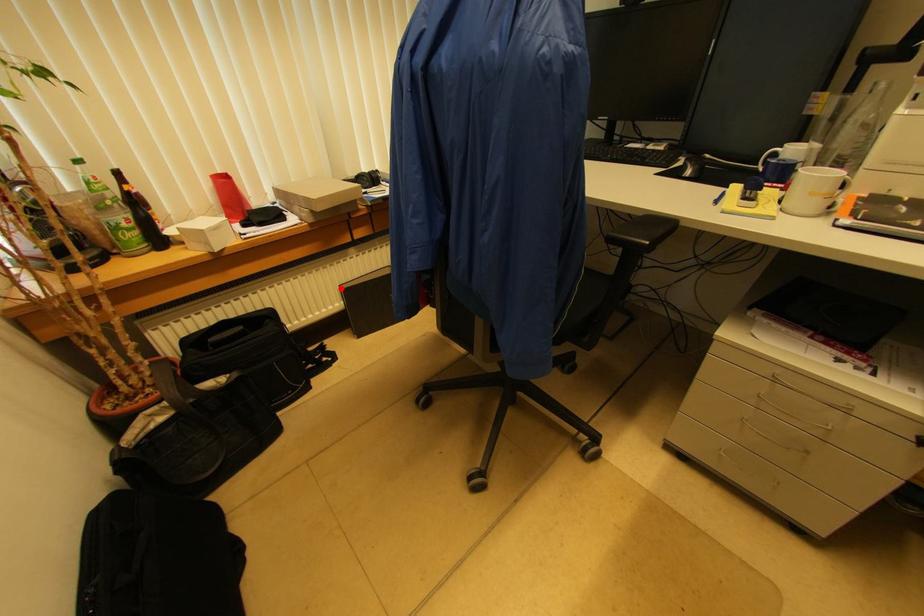
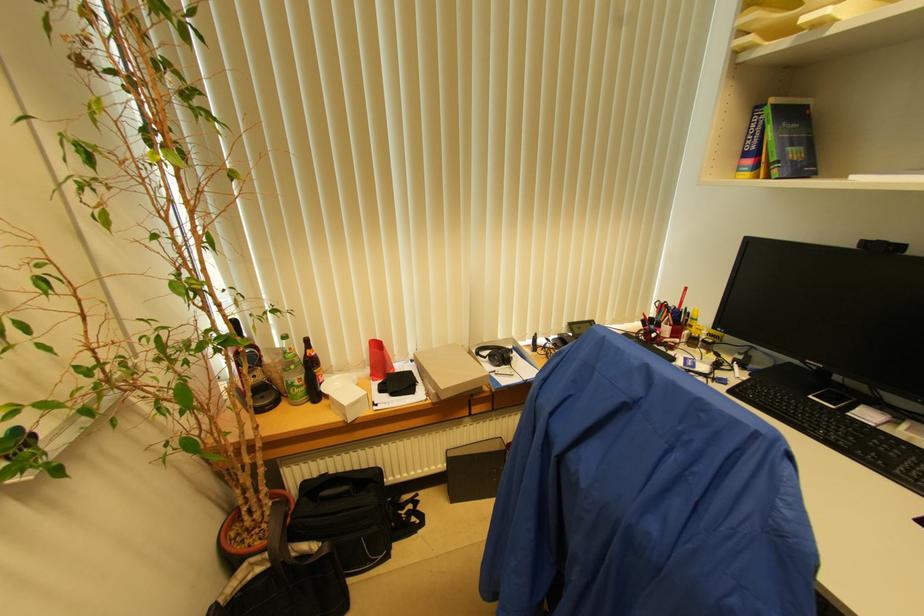
Locate, in the second image, the point that corresponds to the highlighted location in the first image.

(447, 453)